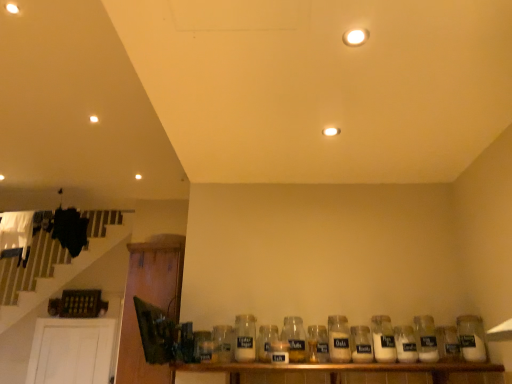
Locate an element on the screen. vacant region in front of clear glass jar at center, which is counted as the fifth bottle, starting from the left is located at coordinates (321, 366).